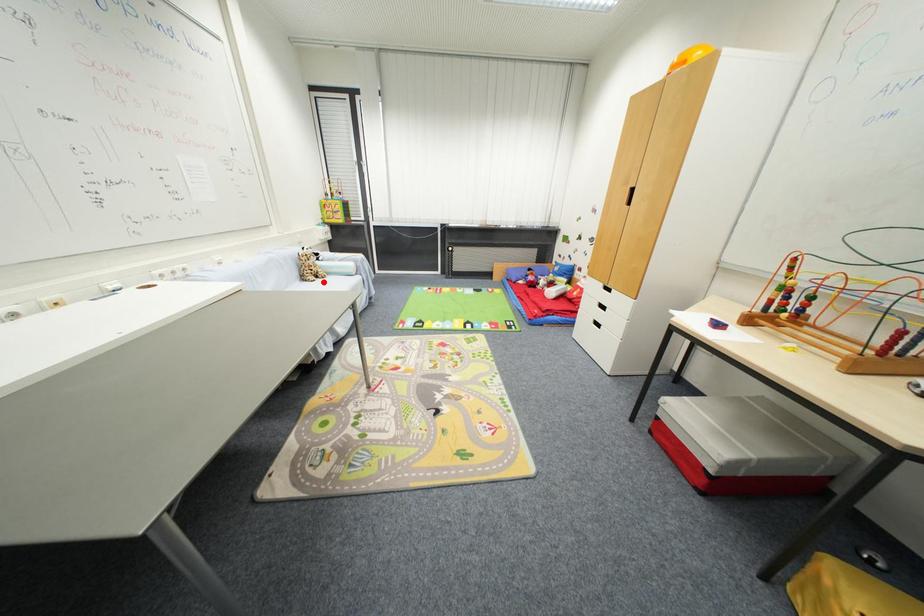
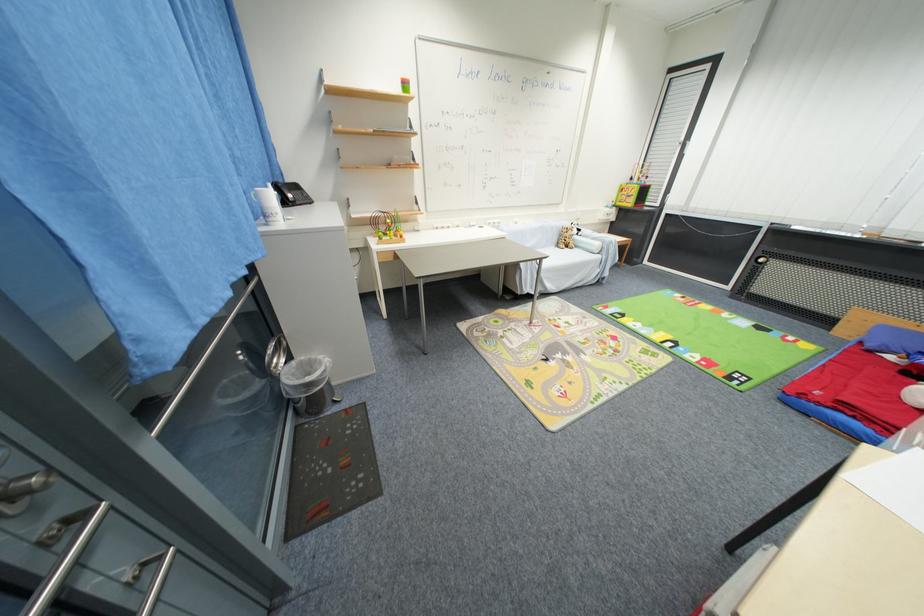
Question: I am providing you with two images of the same scene from different viewpoints. Given a red point in image1, look at the same physical point in image2. Is it:

Choices:
 (A) Closer to the viewpoint
 (B) Farther from the viewpoint

Answer: (B)